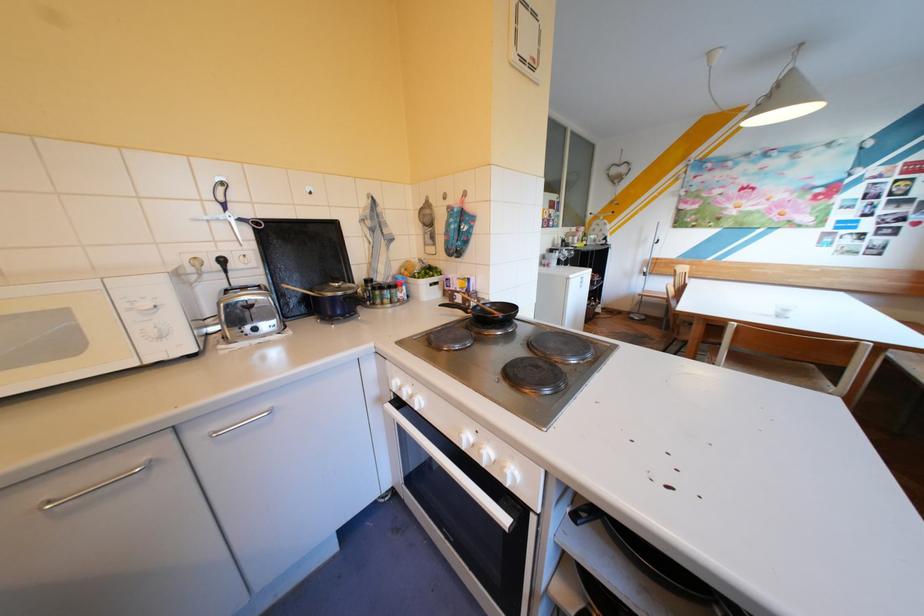
You are a GUI agent. You are given a task and a screenshot of the screen. Output one action in this format:
    pyautogui.click(x=<x>, y=<y>)
    Task: Click on the toaster press lever
    This screenshot has width=924, height=616.
    Given the screenshot: What is the action you would take?
    pyautogui.click(x=248, y=304)